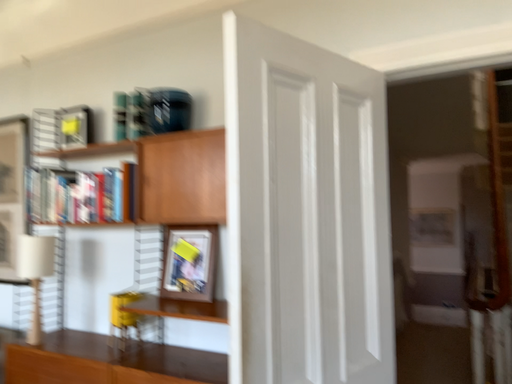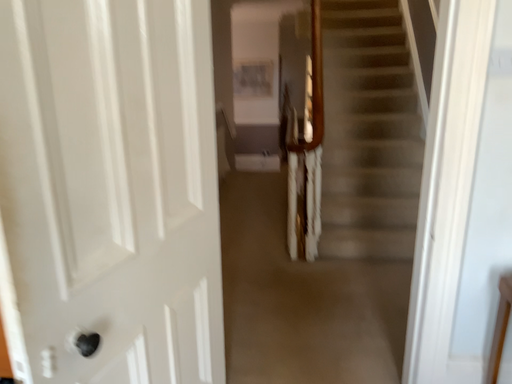
Question: How did the camera likely rotate when shooting the video?

Choices:
 (A) rotated downward
 (B) rotated upward

Answer: (A)